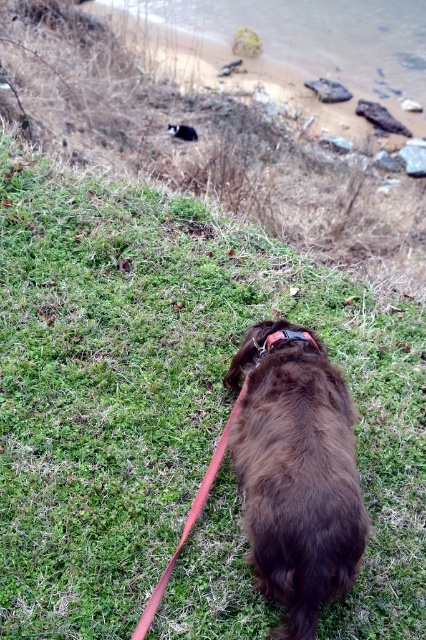
You are standing at the edge of the beach and want to throw a ball to your dog. The ball is currently on the brown sand at upper center. Which direction should you throw the ball so that it rolls towards the brown furry dog at center?

The brown furry dog at center is closer to you than the brown sand at upper center, so you should throw the ball downhill towards the brown furry dog at center.

You are standing at point [256,342] and want to walk towards point [176,36]. Is the path between these two points clear of any obstacles?

The path between point [176,36] and point [256,342] is clear of any obstacles as there are no objects mentioned in the scene description that would block the path between them.